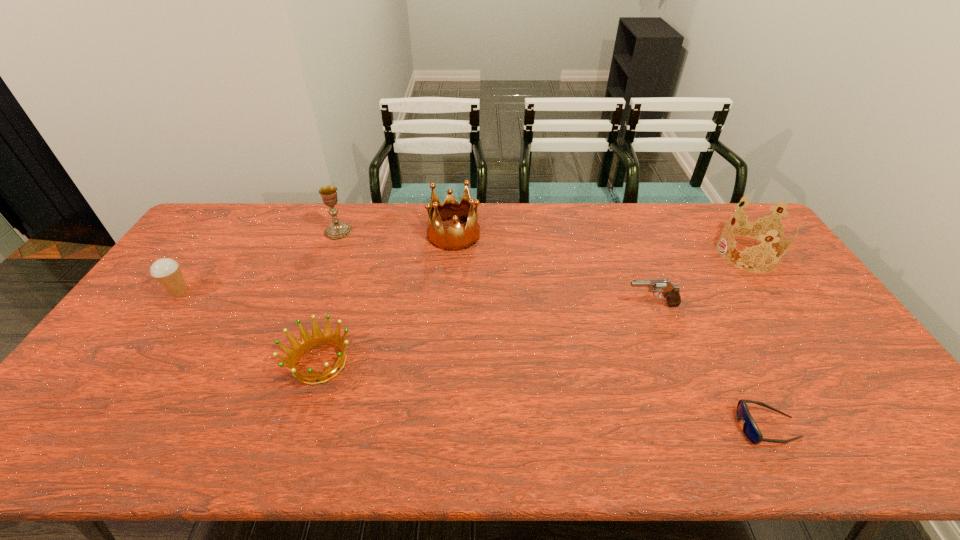
This screenshot has height=540, width=960. Find the location of `vacant region located on the front-facing side of the sixth object from left to right`. vacant region located on the front-facing side of the sixth object from left to right is located at coordinates (599, 427).

Image resolution: width=960 pixels, height=540 pixels. In order to click on free space located on the front-facing side of the sixth object from left to right in this screenshot , I will do `click(577, 427)`.

I want to click on chalice present at the far edge, so click(336, 230).

The width and height of the screenshot is (960, 540). Find the location of `object at the near edge`. object at the near edge is located at coordinates (750, 429).

The width and height of the screenshot is (960, 540). I want to click on object that is at the left edge, so tap(166, 271).

This screenshot has height=540, width=960. In order to click on object at the right edge in this screenshot , I will do (x=760, y=229).

Locate an element on the screen. This screenshot has height=540, width=960. object located in the far right corner section of the desktop is located at coordinates (760, 229).

This screenshot has width=960, height=540. In order to click on vacant space at the far edge of the desktop in this screenshot , I will do `click(396, 227)`.

This screenshot has height=540, width=960. I want to click on vacant space at the near edge, so pyautogui.click(x=528, y=434).

Image resolution: width=960 pixels, height=540 pixels. What are the coordinates of `vacant space at the left edge` in the screenshot? It's located at (186, 318).